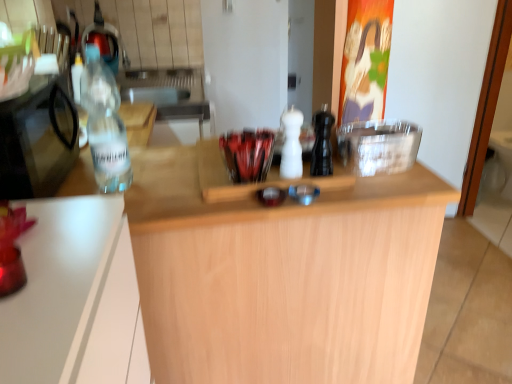
What are the coordinates of `free spot to the right of white matte salt shaker at center, placed as the second bottle when sorted from right to left` in the screenshot? It's located at tap(359, 176).